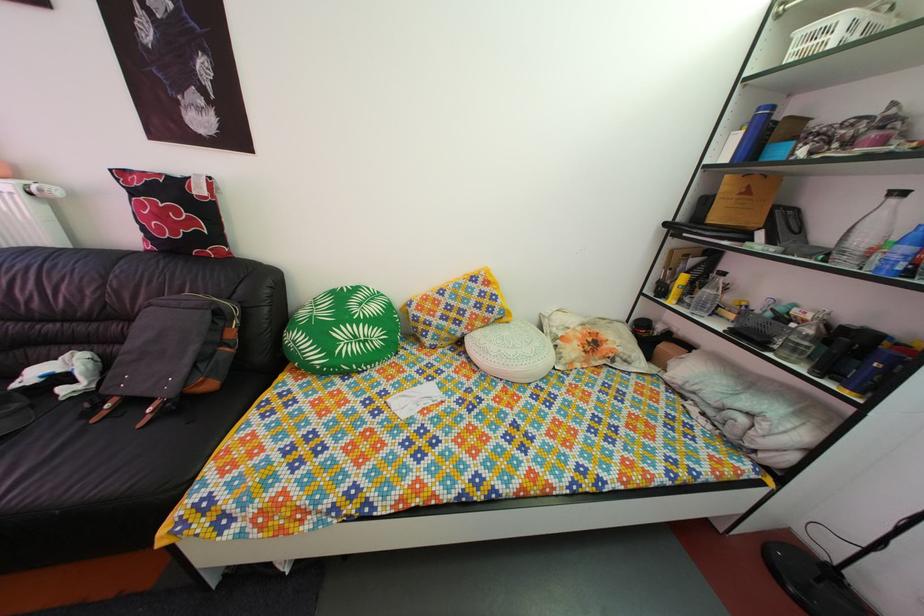
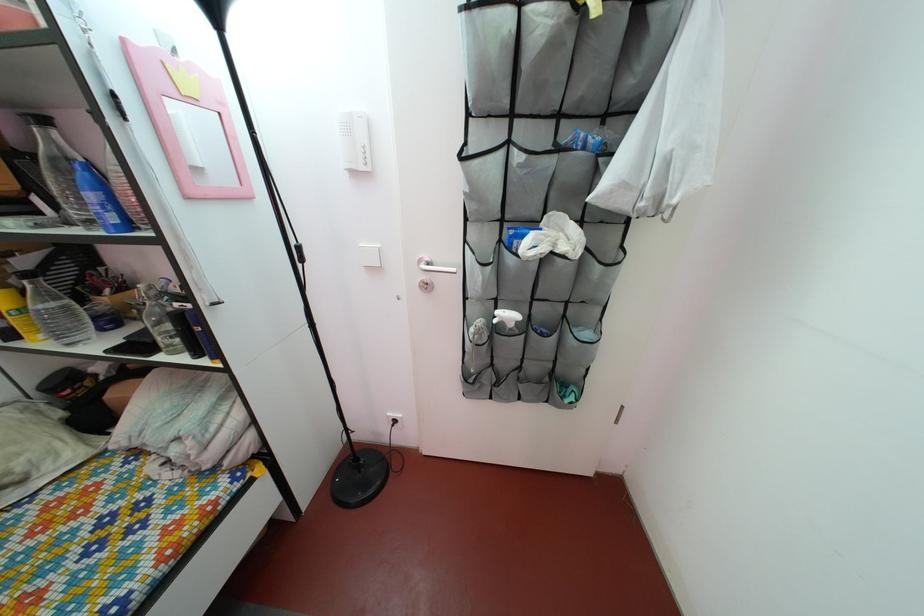
Where in the second image is the point corresponding to (781,249) from the first image?

(68, 217)